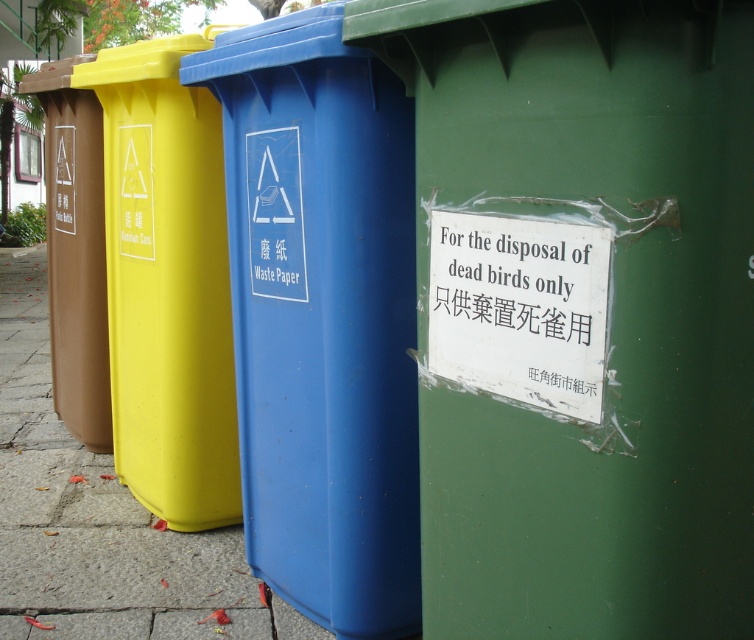
Question: Does blue plastic waste paper at center have a lesser width compared to matte brown trash can at left?

Choices:
 (A) no
 (B) yes

Answer: (A)

Question: Which object is the farthest from the yellow plastic recycling bin at left?

Choices:
 (A) matte brown trash can at left
 (B) green plastic bin at center
 (C) blue plastic waste paper at center

Answer: (B)

Question: Can you confirm if yellow plastic recycling bin at left is thinner than matte brown trash can at left?

Choices:
 (A) yes
 (B) no

Answer: (B)

Question: Which point appears closest to the camera in this image?

Choices:
 (A) (201, 573)
 (B) (130, 154)

Answer: (A)

Question: Which point appears closest to the camera in this image?

Choices:
 (A) (345, 147)
 (B) (60, 156)

Answer: (A)

Question: Can you confirm if matte concrete pavement at center is positioned below matte brown trash can at left?

Choices:
 (A) yes
 (B) no

Answer: (A)